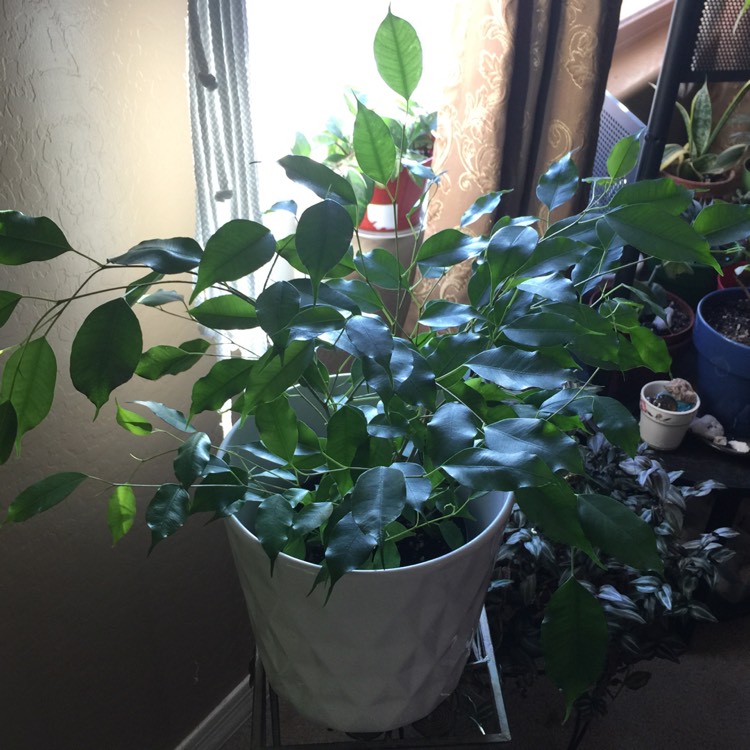
Image resolution: width=750 pixels, height=750 pixels. I want to click on wall, so point(112,166).